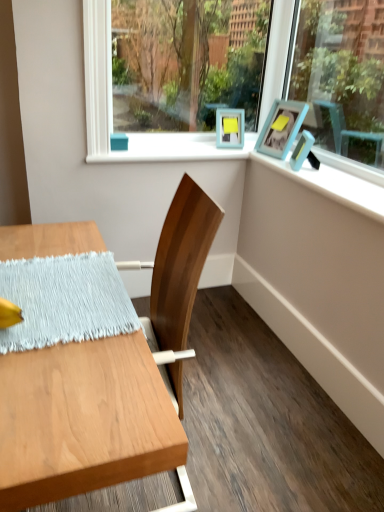
Describe the element at coordinates (304, 152) in the screenshot. I see `matte blue picture frame at upper right, arranged as the first picture frame when viewed from the front` at that location.

This screenshot has height=512, width=384. I want to click on light blue woven placemat at left, so click(x=65, y=301).

The height and width of the screenshot is (512, 384). What do you see at coordinates (85, 421) in the screenshot? I see `wooden table at left` at bounding box center [85, 421].

Measure the distance between point (182,102) and camera.

A distance of 3.96 meters exists between point (182,102) and camera.

Find the location of `matte blue picture frame at upper right, arranged as the first picture frame when viewed from the front`. matte blue picture frame at upper right, arranged as the first picture frame when viewed from the front is located at coordinates (304, 152).

Is there a large distance between light blue woven placemat at left and teal matte picture frame at upper right, which ranks as the second picture frame in front-to-back order?

Yes, light blue woven placemat at left and teal matte picture frame at upper right, which ranks as the second picture frame in front-to-back order, are located far from each other.

Looking at this image, how different are the orientations of light blue woven placemat at left and teal matte picture frame at upper right, which ranks as the second picture frame in front-to-back order, in degrees?

11.4 degrees separate the facing orientations of light blue woven placemat at left and teal matte picture frame at upper right, which ranks as the second picture frame in front-to-back order.

Does light blue woven placemat at left have a greater width compared to teal matte picture frame at upper right, the 1th picture frame positioned from the back?

Yes.

Is point (10, 268) closer to camera compared to point (274, 155)?

Yes.

From a real-world perspective, which object stands above the other?

In real-world perspective, matte blue picture frame at upper right, arranged as the first picture frame when viewed from the front, is above.

Does point (299, 169) come behind point (106, 266)?

Yes, point (299, 169) is farther from viewer.

Looking at their sizes, would you say matte blue picture frame at upper right, which is the second picture frame from back to front, is wider or thinner than light blue woven placemat at left?

Clearly, matte blue picture frame at upper right, which is the second picture frame from back to front, has less width compared to light blue woven placemat at left.

Considering the sizes of matte blue picture frame at upper right, arranged as the first picture frame when viewed from the front, and light blue woven placemat at left in the image, is matte blue picture frame at upper right, arranged as the first picture frame when viewed from the front, taller or shorter than light blue woven placemat at left?

In the image, matte blue picture frame at upper right, arranged as the first picture frame when viewed from the front, appears to be taller than light blue woven placemat at left.

From the image's perspective, is wooden table at left beneath light blue woven placemat at left?

Yes, from the image's perspective, wooden table at left is below light blue woven placemat at left.

What are the coordinates of `table in front of the light blue woven placemat at left` in the screenshot? It's located at (85, 421).

Between wooden table at left and light blue woven placemat at left, which one has smaller size?

light blue woven placemat at left.

From the image's perspective, is blue painted wood at upper right below matte blue picture frame at upper right, which is the second picture frame from back to front?

Indeed, from the image's perspective, blue painted wood at upper right is shown beneath matte blue picture frame at upper right, which is the second picture frame from back to front.

From the picture: Considering the sizes of objects blue painted wood at upper right and matte blue picture frame at upper right, arranged as the first picture frame when viewed from the front, in the image provided, who is thinner, blue painted wood at upper right or matte blue picture frame at upper right, arranged as the first picture frame when viewed from the front,?

matte blue picture frame at upper right, arranged as the first picture frame when viewed from the front, is thinner.

From a real-world perspective, does blue painted wood at upper right stand above matte blue picture frame at upper right, which is the second picture frame from back to front?

No, from a real-world perspective, blue painted wood at upper right is not on top of matte blue picture frame at upper right, which is the second picture frame from back to front.

Looking at this image, considering the sizes of objects wooden table at left and matte blue picture frame at upper right, which is the second picture frame from back to front, in the image provided, who is bigger, wooden table at left or matte blue picture frame at upper right, which is the second picture frame from back to front,?

wooden table at left is bigger.

Could you measure the distance between wooden table at left and matte blue picture frame at upper right, arranged as the first picture frame when viewed from the front?

A distance of 5.31 feet exists between wooden table at left and matte blue picture frame at upper right, arranged as the first picture frame when viewed from the front.

Considering the sizes of wooden table at left and matte blue picture frame at upper right, which is the second picture frame from back to front, in the image, is wooden table at left taller or shorter than matte blue picture frame at upper right, which is the second picture frame from back to front,?

Clearly, wooden table at left is taller compared to matte blue picture frame at upper right, which is the second picture frame from back to front.

From a real-world perspective, who is located lower, wooden table at left or blue painted wood at upper right?

wooden table at left.

I want to click on table in front of the blue painted wood at upper right, so click(x=85, y=421).

Is wooden table at left wider or thinner than blue painted wood at upper right?

wooden table at left is wider than blue painted wood at upper right.

Looking at this image, from a real-world perspective, is blue painted wood at upper right physically below wooden table at left?

Actually, blue painted wood at upper right is physically above wooden table at left in the real world.

Is point (289, 170) farther from viewer compared to point (64, 457)?

Yes, point (289, 170) is farther from viewer.

From the image's perspective, which is above, blue painted wood at upper right or wooden table at left?

From the image's view, blue painted wood at upper right is above.

Is blue painted wood at upper right turned away from wooden table at left?

No, blue painted wood at upper right is not facing away from wooden table at left.

Locate an element on the screen. blanket below the teal matte picture frame at upper right, which ranks as the second picture frame in front-to-back order (from the image's perspective) is located at coordinates (65, 301).

From the light blue woven placemat at left, count 2nd picture frame to the right and point to it. Please provide its 2D coordinates.

[(304, 152)]

Based on the photo, estimate the real-world distances between objects in this image. Which object is further from clear glass window screen at upper center, light blue woven placemat at left or teal matte picture frame at upper right, the 1th picture frame positioned from the back?

light blue woven placemat at left.

Looking at the image, which one is located closer to wooden table at left, matte blue picture frame at upper right, which is the second picture frame from back to front, or light blue woven placemat at left?

Among the two, light blue woven placemat at left is located nearer to wooden table at left.

Which object lies nearer to the anchor point blue painted wood at upper right, light blue woven placemat at left or wooden table at left?

Based on the image, light blue woven placemat at left appears to be nearer to blue painted wood at upper right.

Looking at the image, which one is located further to teal matte picture frame at upper right, which ranks as the second picture frame in front-to-back order, light blue woven placemat at left or wooden table at left?

Among the two, wooden table at left is located further to teal matte picture frame at upper right, which ranks as the second picture frame in front-to-back order.

Estimate the real-world distances between objects in this image. Which object is closer to matte blue picture frame at upper right, which is the second picture frame from back to front, light blue woven placemat at left or blue painted wood at upper right?

Based on the image, blue painted wood at upper right appears to be nearer to matte blue picture frame at upper right, which is the second picture frame from back to front.

Estimate the real-world distances between objects in this image. Which object is closer to light blue woven placemat at left, matte blue picture frame at upper right, arranged as the first picture frame when viewed from the front, or wooden table at left?

wooden table at left is closer to light blue woven placemat at left.

Considering their positions, is blue painted wood at upper right positioned closer to wooden table at left than matte blue picture frame at upper right, arranged as the first picture frame when viewed from the front?

Based on the image, blue painted wood at upper right appears to be nearer to wooden table at left.

Consider the image. Considering their positions, is matte blue picture frame at upper right, arranged as the first picture frame when viewed from the front, positioned closer to blue painted wood at upper right than teal matte picture frame at upper right, the 1th picture frame positioned from the back?

matte blue picture frame at upper right, arranged as the first picture frame when viewed from the front, lies closer to blue painted wood at upper right than the other object.

At what (x,y) coordinates should I click in order to perform the action: click on blanket between clear glass window screen at upper center and wooden table at left from top to bottom. Please return your answer as a coordinate pair (x, y). The height and width of the screenshot is (512, 384). Looking at the image, I should click on (65, 301).

Identify the location of window screen between light blue woven placemat at left and teal matte picture frame at upper right, the 1th picture frame positioned from the back, in the front-back direction. The height and width of the screenshot is (512, 384). (186, 62).

Locate an element on the screen. The image size is (384, 512). window screen positioned between wooden table at left and teal matte picture frame at upper right, which ranks as the second picture frame in front-to-back order, from near to far is located at coordinates (186, 62).

At what (x,y) coordinates should I click in order to perform the action: click on window sill between wooden table at left and teal matte picture frame at upper right, the 1th picture frame positioned from the back, in the front-back direction. Please return your answer as a coordinate pair (x, y). Looking at the image, I should click on (332, 185).